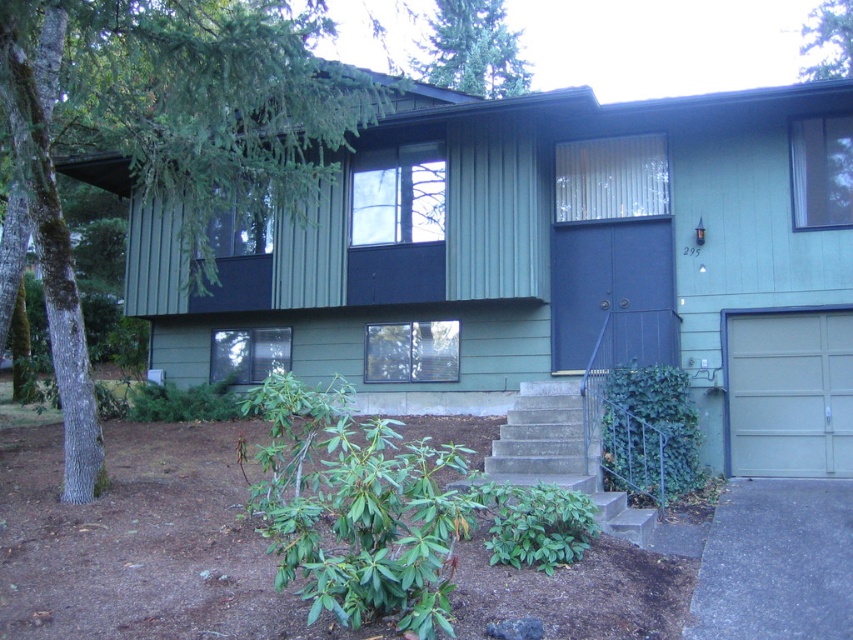
Question: From the image, what is the correct spatial relationship of brown dirt at lower center in relation to green textured evergreen tree at upper center?

Choices:
 (A) below
 (B) above

Answer: (A)

Question: Does green mossy tree at left appear under blue matte door at center?

Choices:
 (A) yes
 (B) no

Answer: (B)

Question: Which point is closer to the camera taking this photo?

Choices:
 (A) (836, 45)
 (B) (726, 588)
 (C) (581, 284)

Answer: (B)

Question: Which object appears closest to the camera in this image?

Choices:
 (A) brown dirt at lower center
 (B) matte gray garage door at lower right
 (C) blue matte door at center
 (D) gray concrete driveway at lower right

Answer: (A)

Question: Can you confirm if brown dirt at lower center is positioned below green leafy tree at upper right?

Choices:
 (A) no
 (B) yes

Answer: (B)

Question: Which point is farther to the camera?

Choices:
 (A) gray concrete driveway at lower right
 (B) matte gray garage door at lower right

Answer: (B)